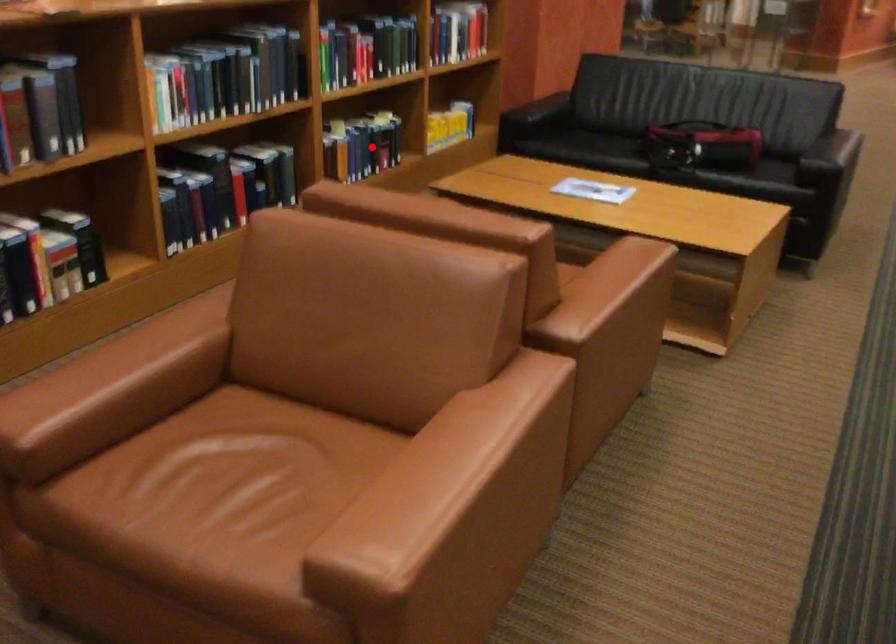
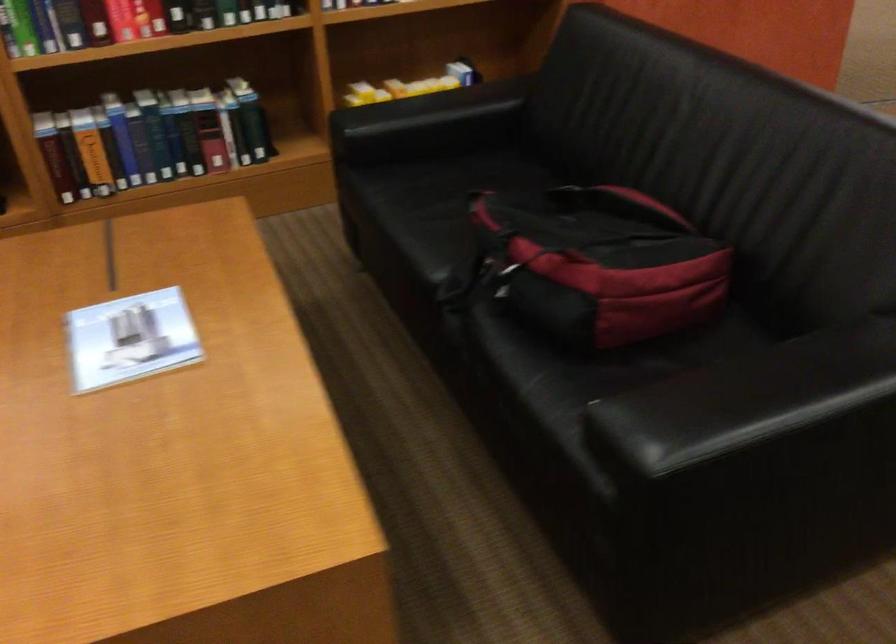
Question: I am providing you with two images of the same scene from different viewpoints. In image1, a red point is highlighted. Considering the same 3D point in image2, which of the following is correct?

Choices:
 (A) It is closer
 (B) It is farther

Answer: (A)